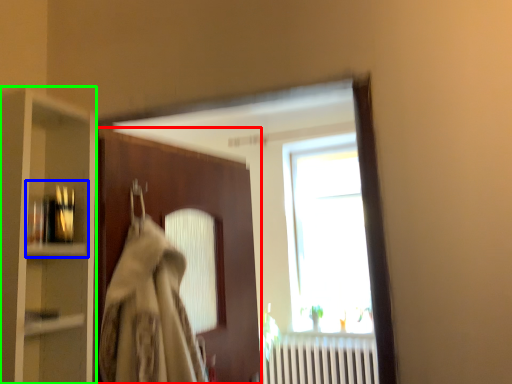
Question: Which is nearer to the door (highlighted by a red box)? shelf (highlighted by a blue box) or cabinetry (highlighted by a green box).

Choices:
 (A) shelf
 (B) cabinetry

Answer: (B)